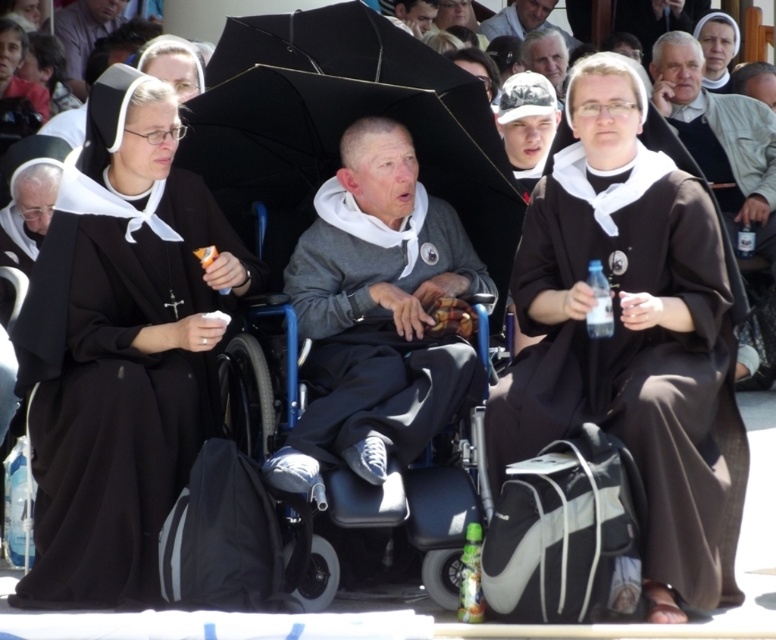
Is smooth gray hair at upper center taller than gray hair at upper center?

Incorrect, smooth gray hair at upper center's height is not larger of gray hair at upper center's.

Between smooth gray hair at upper center and gray hair at upper center, which one appears on the right side from the viewer's perspective?

gray hair at upper center is more to the right.

Is point (525, 17) positioned in front of point (553, 49)?

No, it is behind (553, 49).

The image size is (776, 640). I want to click on smooth gray hair at upper center, so click(x=522, y=20).

Is black matte nun's habit at left taller than matte black wheelchair at upper center?

Correct, black matte nun's habit at left is much taller as matte black wheelchair at upper center.

Is black matte nun's habit at left above matte black wheelchair at upper center?

No.

Is point (63, 378) positioned behind point (92, 28)?

No, it is not.

At what (x,y) coordinates should I click in order to perform the action: click on black matte nun's habit at left. Please return your answer as a coordinate pair (x, y). The width and height of the screenshot is (776, 640). Looking at the image, I should click on (120, 348).

Who is lower down, matte black nun at upper center or gray hair at upper center?

gray hair at upper center is below.

Is matte black nun at upper center above gray hair at upper center?

Indeed, matte black nun at upper center is positioned over gray hair at upper center.

Locate an element on the screen. This screenshot has height=640, width=776. matte black nun at upper center is located at coordinates (716, 49).

Locate an element on the screen. Image resolution: width=776 pixels, height=640 pixels. matte black nun at upper center is located at coordinates (716, 49).